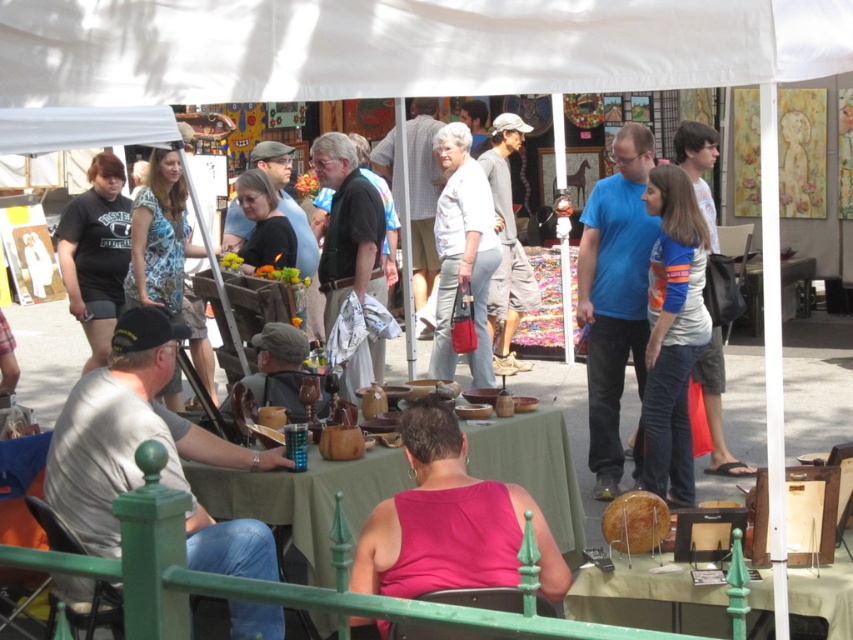
You are a vendor at the market and need to place a new item on the table. Which object, the green fabric table at center or the blue jersey at center, has enough space to accommodate a medium sized item?

The blue jersey at center has enough space since it is larger than the green fabric table at center.

You are standing at point A and want to walk to point B. The path is blocked by a vendor table. If point A is at coordinates point (532, 308) and point B is at coordinates point (733, 460), which direction should you move to go around the table?

Since point (532, 308) is behind point (733, 460), you should move forward towards point B while navigating around the vendor table blocking the path.